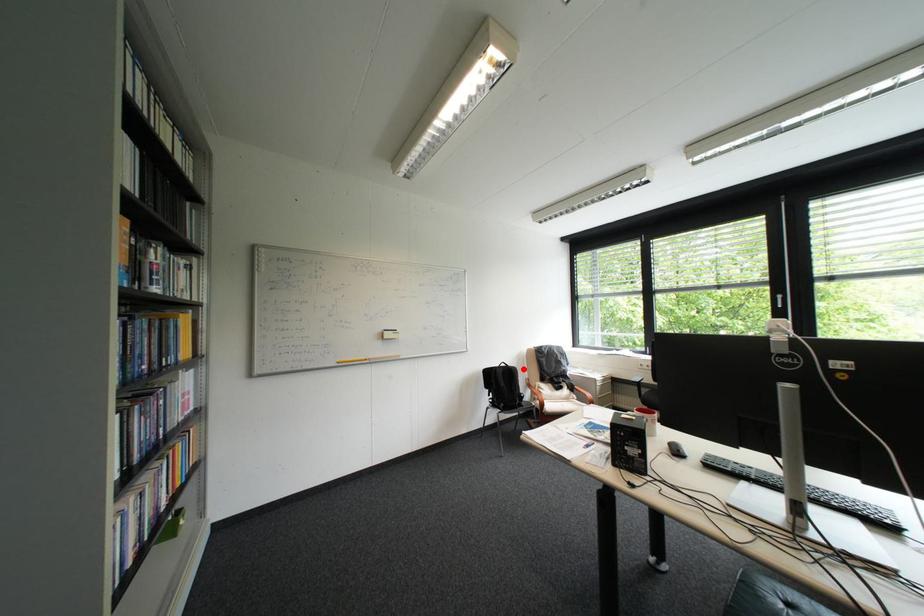
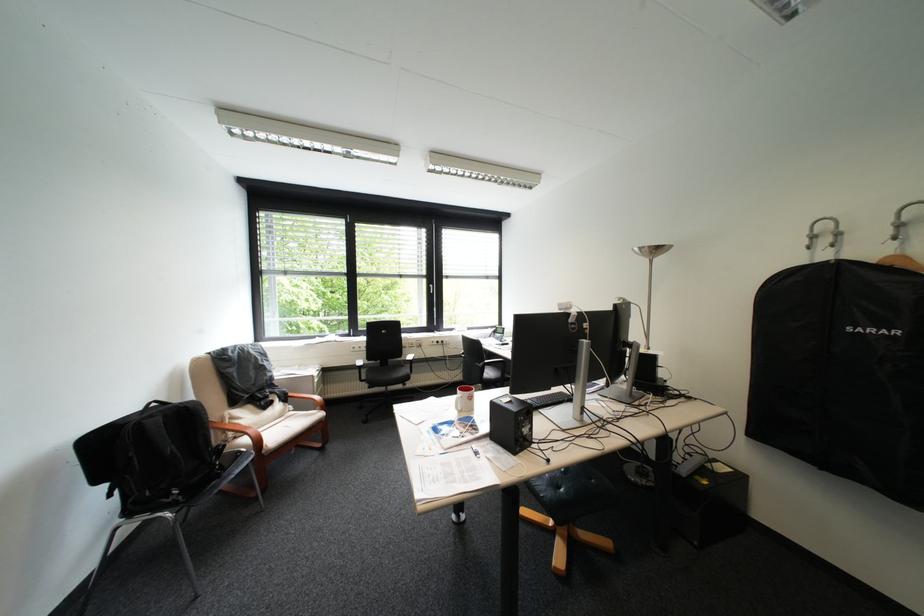
Find the pixel in the second image that matches the highlighted location in the first image.

(199, 407)